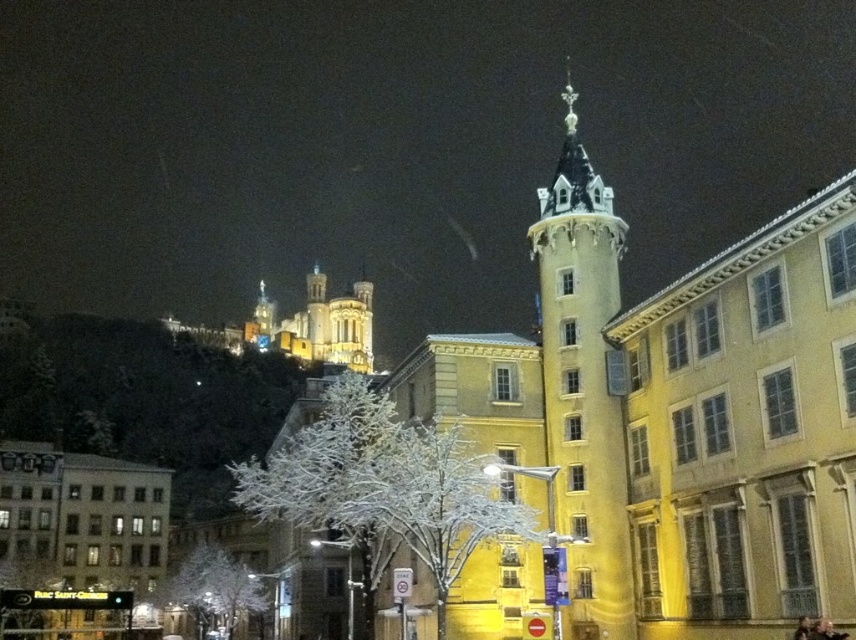
Is matte yellow tower at center thinner than white snow-covered tree at lower center?

Incorrect, matte yellow tower at center's width is not less than white snow-covered tree at lower center's.

Between matte yellow tower at center and white snow-covered tree at lower center, which one appears on the right side from the viewer's perspective?

Positioned to the right is matte yellow tower at center.

Which is in front, point (599, 401) or point (193, 582)?

Point (599, 401)

You are a GUI agent. You are given a task and a screenshot of the screen. Output one action in this format:
    pyautogui.click(x=<x>, y=<y>)
    Task: Click on the matte yellow tower at center
    The width and height of the screenshot is (856, 640).
    Given the screenshot: What is the action you would take?
    pyautogui.click(x=583, y=385)

Who is positioned more to the right, snow-covered tree at center or white snow-covered tree at lower center?

Positioned to the right is snow-covered tree at center.

Does snow-covered tree at center appear over white snow-covered tree at lower center?

Yes.

Is point (467, 467) closer to camera compared to point (204, 557)?

Yes, it is in front of point (204, 557).

The height and width of the screenshot is (640, 856). Find the location of `snow-covered tree at center`. snow-covered tree at center is located at coordinates (383, 486).

Can you confirm if matte yellow tower at center is thinner than snow-covered tree at center?

No, matte yellow tower at center is not thinner than snow-covered tree at center.

In the scene shown: Who is taller, matte yellow tower at center or snow-covered tree at center?

matte yellow tower at center is taller.

Who is more distant from viewer, (x=554, y=436) or (x=287, y=499)?

Point (x=554, y=436)

The width and height of the screenshot is (856, 640). What are the coordinates of `matte yellow tower at center` in the screenshot? It's located at (583, 385).